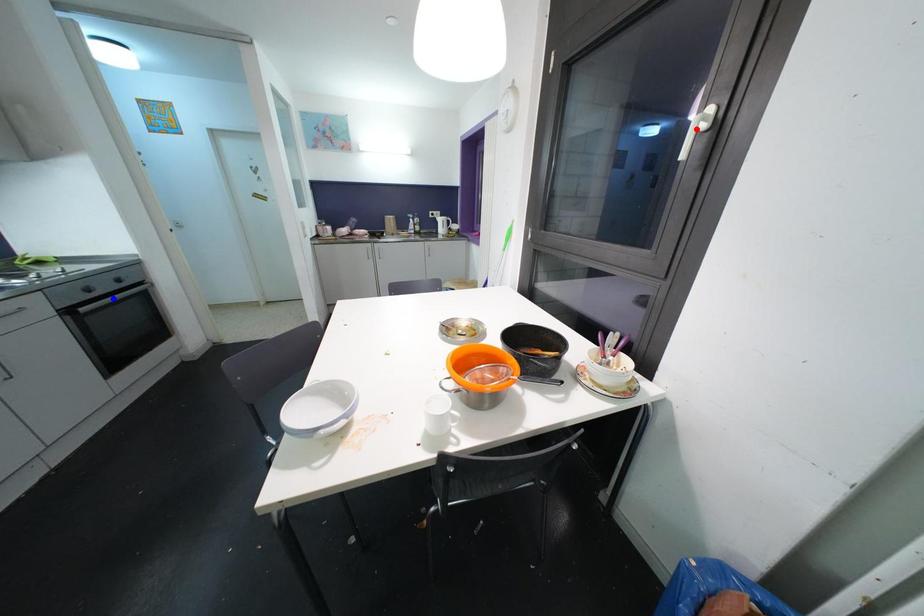
Question: In the image, two points are highlighted. Which point is nearer to the camera? Reply with the corresponding letter.

Choices:
 (A) blue point
 (B) red point

Answer: (B)